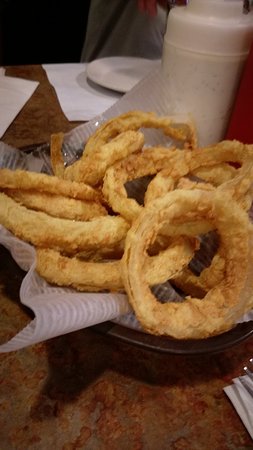
Identify the location of plate. The width and height of the screenshot is (253, 450). (100, 70).